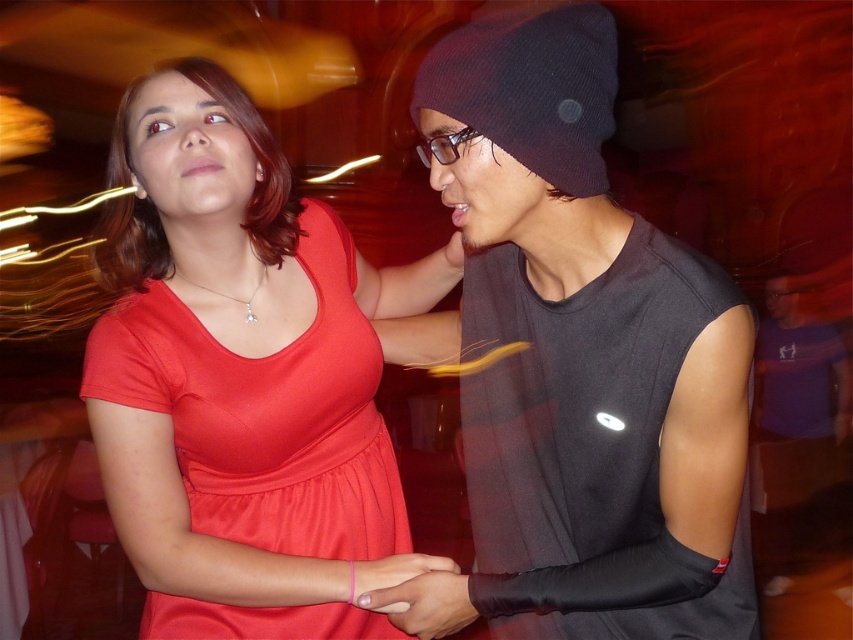
Question: Which of the following is the farthest from the observer?

Choices:
 (A) (457, 596)
 (B) (612, 124)
 (C) (538, 406)
 (D) (433, 577)

Answer: (D)

Question: Is black matte shirt at right thinner than pink matte wristband at center?

Choices:
 (A) yes
 (B) no

Answer: (B)

Question: Among these points, which one is nearest to the camera?

Choices:
 (A) (444, 634)
 (B) (701, 285)
 (C) (787, 577)
 (D) (331, 376)

Answer: (B)

Question: Which point is closer to the camera?

Choices:
 (A) pink rubber band at center
 (B) black matte shirt at right
 (C) black knit beanie at upper right

Answer: (C)

Question: Can you confirm if black knit beanie at upper right is thinner than black knit beanie at upper center?

Choices:
 (A) no
 (B) yes

Answer: (A)

Question: Can you confirm if black matte shirt at right is thinner than pink rubber band at center?

Choices:
 (A) no
 (B) yes

Answer: (A)